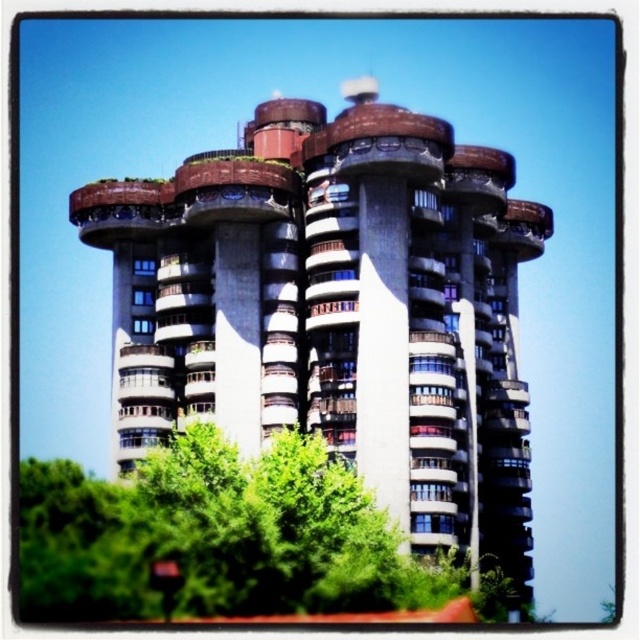
Is point (417, 218) positioned after point (67, 522)?

Yes, it is.

Who is more forward, (321,384) or (289,470)?

Positioned in front is point (289,470).

Which is in front, point (451, 438) or point (173, 456)?

Positioned in front is point (173, 456).

I want to click on concrete building at center, so click(337, 308).